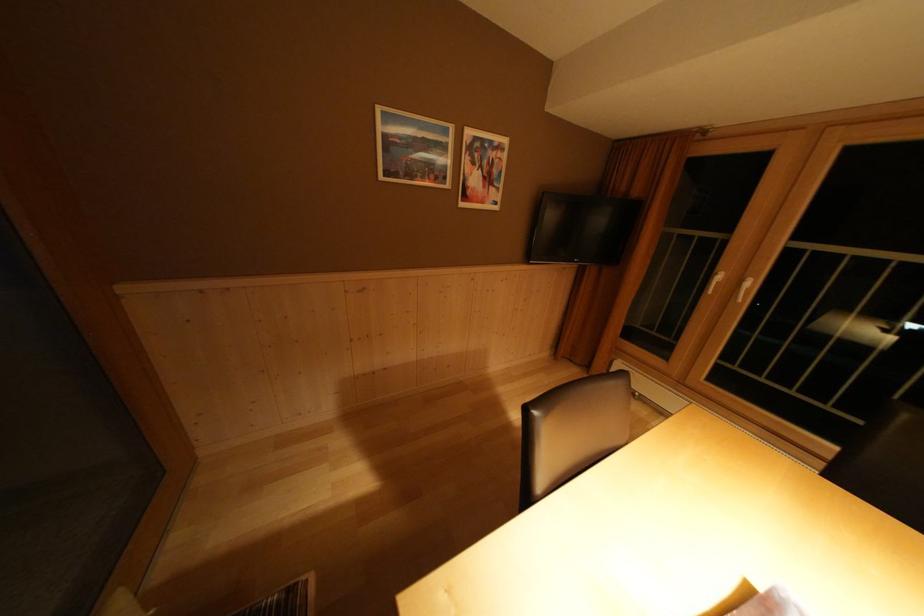
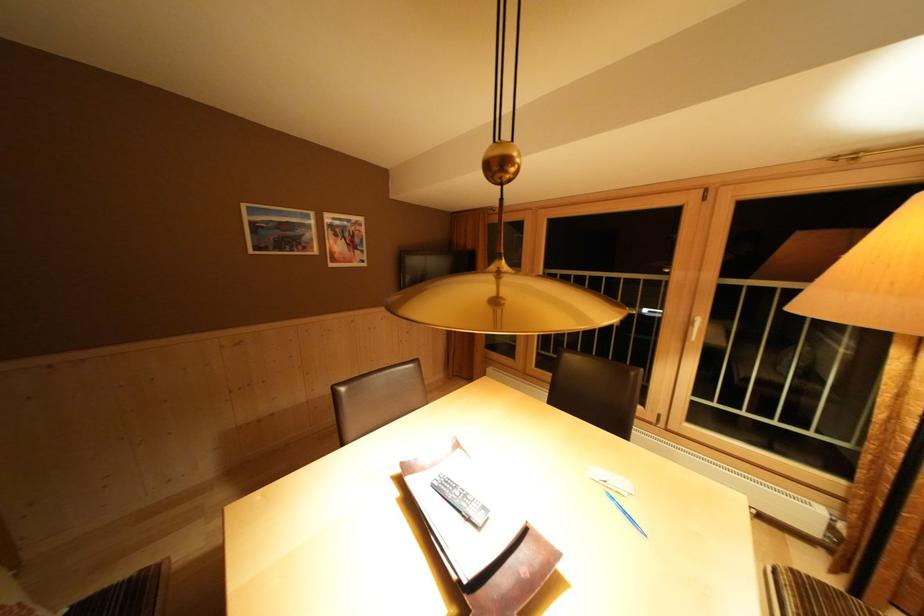
Question: The camera is either moving clockwise (left) or counter-clockwise (right) around the object. The first image is from the beginning of the video and the second image is from the end. Is the camera moving left or right when shooting the video?

Choices:
 (A) Left
 (B) Right

Answer: (A)